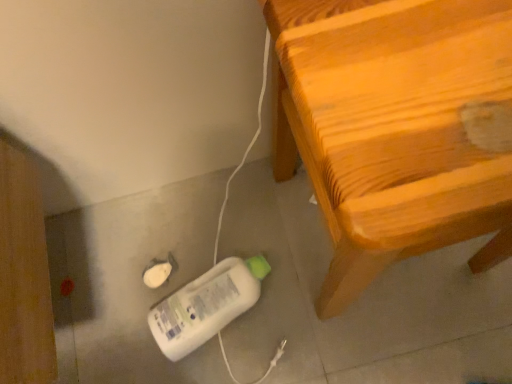
Where is `vacant point above white plastic bottle at lower center (from a real-world perspective)`? Image resolution: width=512 pixels, height=384 pixels. vacant point above white plastic bottle at lower center (from a real-world perspective) is located at coordinates (229, 299).